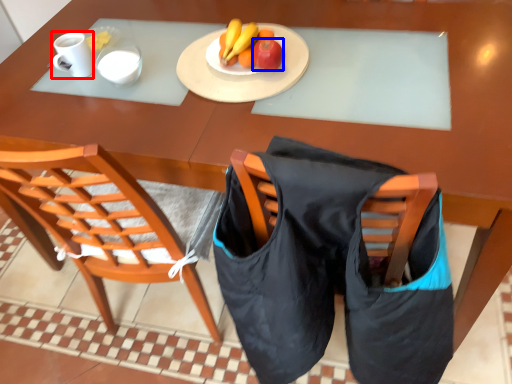
Question: Which of the following is the closest to the observer, coffee cup (highlighted by a red box) or apple (highlighted by a blue box)?

Choices:
 (A) coffee cup
 (B) apple

Answer: (B)